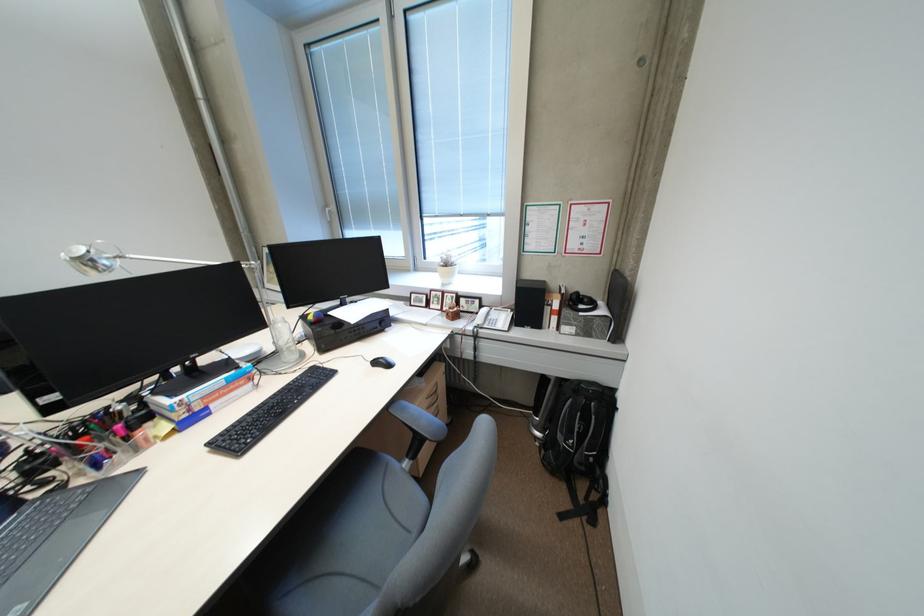
You are a GUI agent. You are given a task and a screenshot of the screen. Output one action in this format:
    pyautogui.click(x=<x>, y=<y>)
    Task: Click on the chair sitting surface
    The image size is (924, 616).
    Given the screenshot: What is the action you would take?
    pyautogui.click(x=370, y=515)